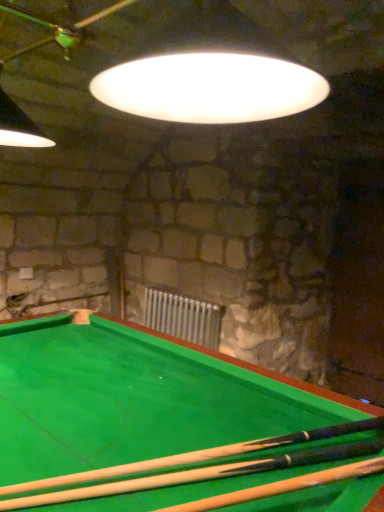
Question: In the image, is wooden cue at bottom on the left side or the right side of metallic silver radiator at center?

Choices:
 (A) right
 (B) left

Answer: (A)

Question: Looking at the image, does wooden cue at bottom seem bigger or smaller compared to metallic silver radiator at center?

Choices:
 (A) big
 (B) small

Answer: (B)

Question: From the image's perspective, is wooden cue at bottom above or below metallic silver radiator at center?

Choices:
 (A) below
 (B) above

Answer: (B)

Question: Is metallic silver radiator at center wider or thinner than wooden cue at bottom?

Choices:
 (A) thin
 (B) wide

Answer: (A)

Question: Would you say metallic silver radiator at center is to the left or to the right of wooden cue at bottom in the picture?

Choices:
 (A) left
 (B) right

Answer: (A)

Question: From the image's perspective, relative to wooden cue at bottom, is metallic silver radiator at center above or below?

Choices:
 (A) below
 (B) above

Answer: (A)

Question: Is metallic silver radiator at center bigger or smaller than wooden cue at bottom?

Choices:
 (A) small
 (B) big

Answer: (B)